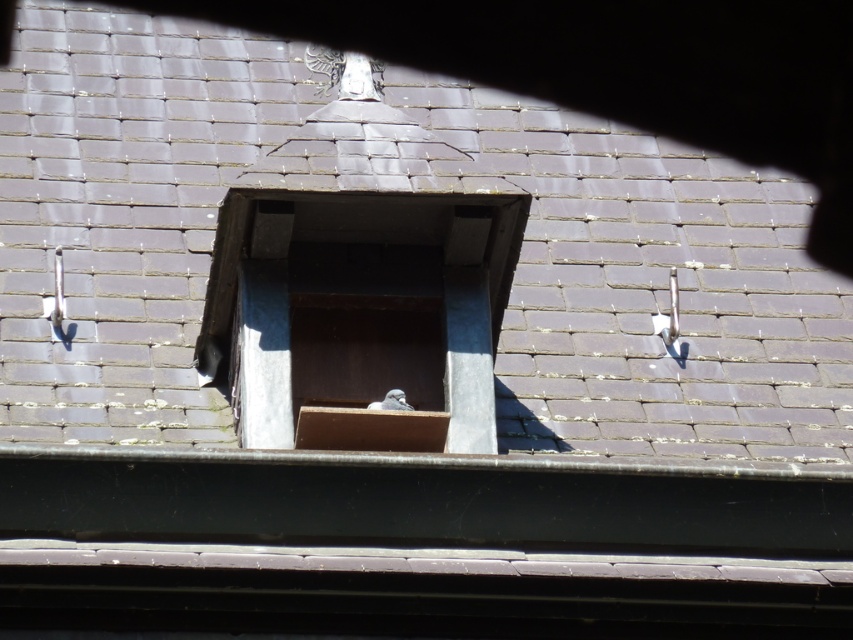
You are a construction worker standing on the smooth slate roof at center. You need to place a tool that is 10 feet long on the wooden box at center. Can you safely place it there without overhanging the edge? Please explain your reasoning.

The smooth slate roof at center is 31.15 feet away from the wooden box at center. Since the tool is only 10 feet long, there is sufficient space between the two objects to safely place the tool on the wooden box at center without overhanging the edge.

You are on a rooftop and see the smooth slate roof at center and the wooden box at center. Which object is closer to you?

The smooth slate roof at center is closer to you because it is in front of the wooden box at center.